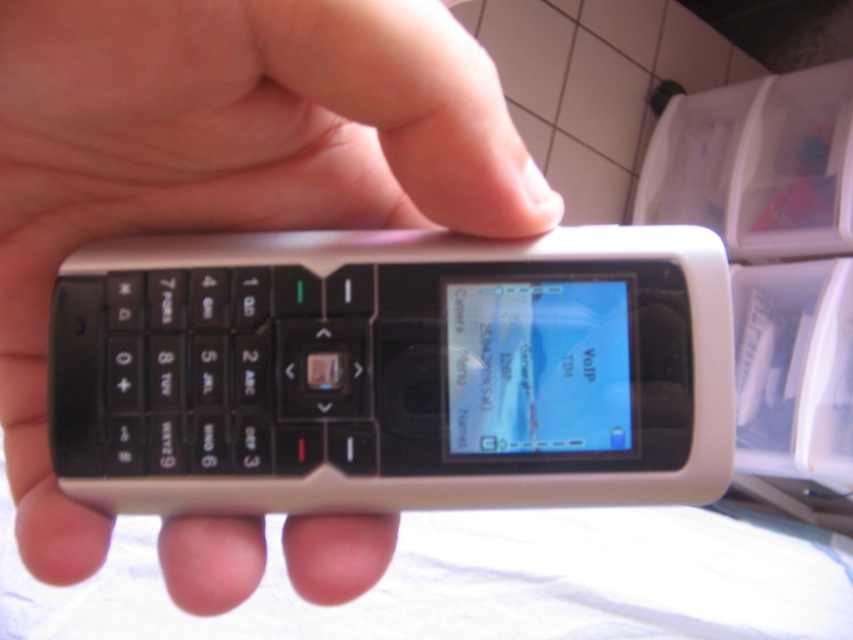
You are trying to place a 1.5 inch wide decorative sticker between the silver matte phone at center and the white matte phone at center. Can the sticker fit in the space between them?

The distance between the silver matte phone at center and the white matte phone at center is 1.51 inches, which is slightly larger than the 1.5 inch sticker. Therefore, the sticker can fit in the space between them.

You are holding a classic feature phone with a physical keypad. There is a specific point on the phone at coordinates point (233, 502). If your thumb is 2 inches wide, can you reach that point without moving your hand?

The distance between point (233, 502) and the viewer is 12.33 inches. Since your thumb is only 2 inches wide, you cannot reach that point without moving your hand.

You have two phones in front of you, a silver matte phone at center and a white matte phone at center. Which one is wider?

The silver matte phone at center is wider than the white matte phone at center according to the description.